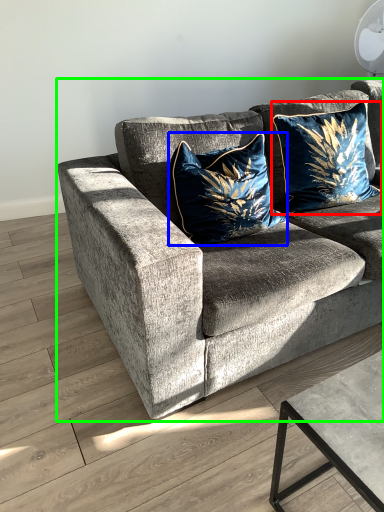
Question: Estimate the real-world distances between objects in this image. Which object is closer to pillow (highlighted by a red box), pillow (highlighted by a blue box) or studio couch (highlighted by a green box)?

Choices:
 (A) pillow
 (B) studio couch

Answer: (A)